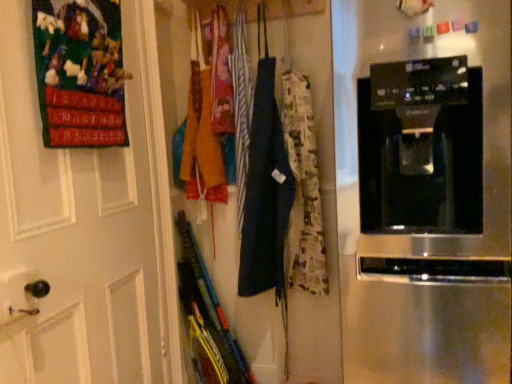
Question: From a real-world perspective, is white matte door at upper left beneath black glossy coffee maker at center?

Choices:
 (A) yes
 (B) no

Answer: (B)

Question: Can you confirm if white matte door at upper left is taller than black glossy coffee maker at center?

Choices:
 (A) no
 (B) yes

Answer: (B)

Question: Is white matte door at upper left wider than black glossy coffee maker at center?

Choices:
 (A) yes
 (B) no

Answer: (B)

Question: Considering the relative sizes of white matte door at upper left and black glossy coffee maker at center in the image provided, is white matte door at upper left shorter than black glossy coffee maker at center?

Choices:
 (A) no
 (B) yes

Answer: (A)

Question: Is white matte door at upper left directly adjacent to black glossy coffee maker at center?

Choices:
 (A) no
 (B) yes

Answer: (A)

Question: From the image's perspective, is white matte door at upper left under black glossy coffee maker at center?

Choices:
 (A) no
 (B) yes

Answer: (B)

Question: Considering the relative sizes of printed fabric apron at center and white matte door at upper left in the image provided, is printed fabric apron at center smaller than white matte door at upper left?

Choices:
 (A) no
 (B) yes

Answer: (B)

Question: From the image's perspective, is printed fabric apron at center located beneath white matte door at upper left?

Choices:
 (A) no
 (B) yes

Answer: (A)

Question: Is printed fabric apron at center at the left side of white matte door at upper left?

Choices:
 (A) yes
 (B) no

Answer: (B)

Question: Is printed fabric apron at center positioned behind white matte door at upper left?

Choices:
 (A) no
 (B) yes

Answer: (B)

Question: Could white matte door at upper left be considered to be inside printed fabric apron at center?

Choices:
 (A) yes
 (B) no

Answer: (B)

Question: Is printed fabric apron at center shorter than white matte door at upper left?

Choices:
 (A) yes
 (B) no

Answer: (A)

Question: Can you confirm if printed fabric apron at center is shorter than black glossy coffee maker at center?

Choices:
 (A) yes
 (B) no

Answer: (A)